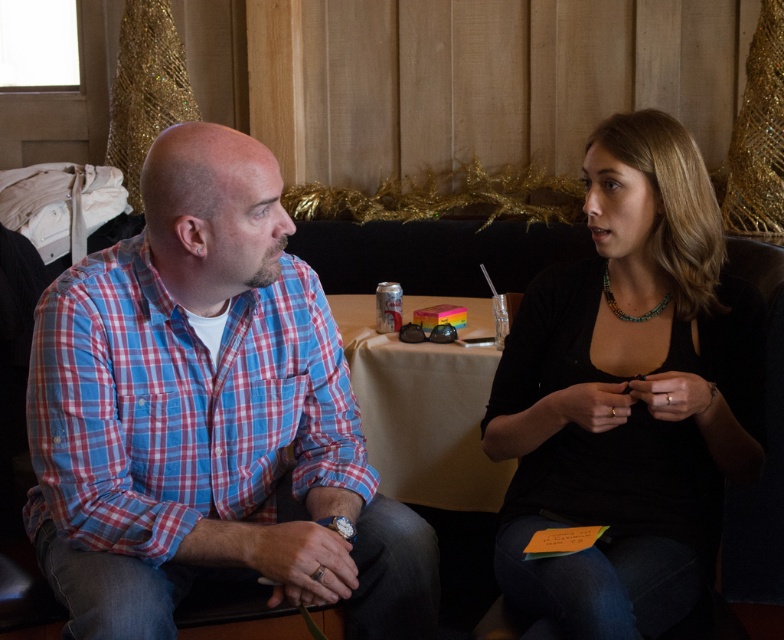
Question: Can you confirm if blue plaid shirt at left is smaller than black matte shirt at center?

Choices:
 (A) no
 (B) yes

Answer: (A)

Question: Among these points, which one is nearest to the camera?

Choices:
 (A) (717, 492)
 (B) (95, 308)

Answer: (B)

Question: Can you confirm if blue plaid shirt at left is positioned above black matte shirt at center?

Choices:
 (A) no
 (B) yes

Answer: (A)

Question: Considering the relative positions of blue plaid shirt at left and black matte shirt at center in the image provided, where is blue plaid shirt at left located with respect to black matte shirt at center?

Choices:
 (A) right
 (B) left

Answer: (B)